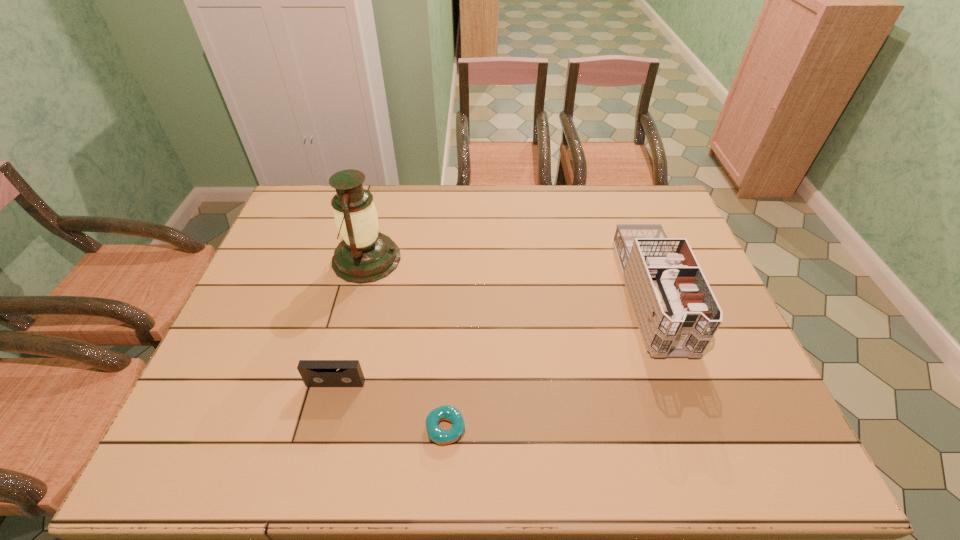
You are a GUI agent. You are given a task and a screenshot of the screen. Output one action in this format:
    pyautogui.click(x=<x>, y=<y>)
    Task: Click on the vacant point located 0.280m on the right of the nearest object
    
    Given the screenshot: What is the action you would take?
    pyautogui.click(x=589, y=428)

You are a GUI agent. You are given a task and a screenshot of the screen. Output one action in this format:
    pyautogui.click(x=<x>, y=<y>)
    Task: Click on the object positioned at the near edge
    
    Given the screenshot: What is the action you would take?
    pyautogui.click(x=449, y=413)

Identify the location of object at the right edge. The height and width of the screenshot is (540, 960). (677, 314).

Where is `free spot at the far edge of the desktop`? The image size is (960, 540). free spot at the far edge of the desktop is located at coordinates (381, 221).

Where is `vacant space at the near edge of the desktop`? This screenshot has width=960, height=540. vacant space at the near edge of the desktop is located at coordinates (641, 470).

Locate an element on the screen. This screenshot has height=540, width=960. free space at the left edge of the desktop is located at coordinates (284, 254).

In the image, there is a desktop. Where is `vacant area at the near left corner`? The width and height of the screenshot is (960, 540). vacant area at the near left corner is located at coordinates (247, 447).

Locate an element on the screen. free space at the far right corner is located at coordinates (618, 190).

Identify the location of free space at the near right corner. The height and width of the screenshot is (540, 960). pyautogui.click(x=740, y=462).

The image size is (960, 540). In order to click on unoccupied position between the tallest object and the second object from right to left in this screenshot , I will do `click(406, 343)`.